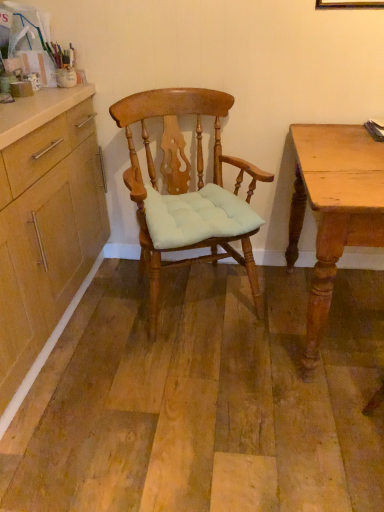
Question: In terms of height, does matte wood chair at center look taller or shorter compared to light brown wooden desk at right?

Choices:
 (A) tall
 (B) short

Answer: (A)

Question: From the image's perspective, relative to light brown wooden desk at right, is matte wood chair at center above or below?

Choices:
 (A) above
 (B) below

Answer: (A)

Question: Considering the positions of point (148, 266) and point (296, 131), is point (148, 266) closer or farther from the camera than point (296, 131)?

Choices:
 (A) farther
 (B) closer

Answer: (A)

Question: Is light brown wooden desk at right bigger or smaller than matte wood chair at center?

Choices:
 (A) small
 (B) big

Answer: (B)

Question: Is light brown wooden desk at right in front of or behind matte wood chair at center in the image?

Choices:
 (A) behind
 (B) front

Answer: (B)

Question: From the image's perspective, is light brown wooden desk at right located above or below matte wood chair at center?

Choices:
 (A) above
 (B) below

Answer: (B)

Question: From a real-world perspective, is light brown wooden desk at right positioned above or below matte wood chair at center?

Choices:
 (A) below
 (B) above

Answer: (A)